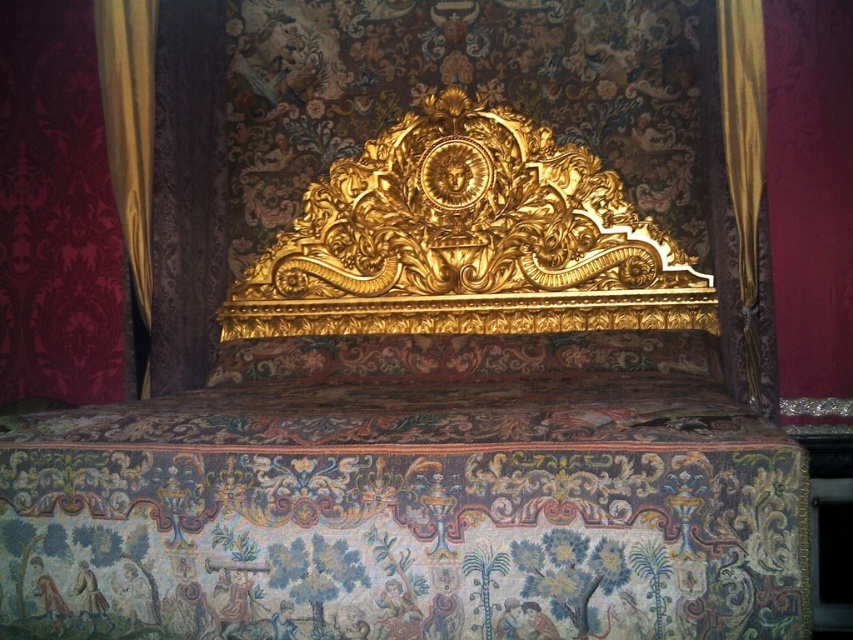
You are an interior designer assessing the symmetry of the room. The gold fabric curtain at left and the gold fabric curtain at right are part of the design. Which curtain is taller?

The gold fabric curtain at left is taller than the gold fabric curtain at right.

Based on the photo, you are an interior designer assessing the symmetry of the room. The gold fabric curtain at left and the gold fabric curtain at right are part of the design. Based on their placement, which curtain could potentially allow more light into the room if opened?

The gold fabric curtain at left might allow more light into the room if opened since it might be wider than the gold fabric curtain at right according to the description.

You are standing in front of the ornate bed and notice two gold fabric curtains. Which curtain is closer to you, the gold fabric curtain at left or the gold fabric curtain at right?

The gold fabric curtain at left is closer to you because it is further to the viewer than the gold fabric curtain at right.